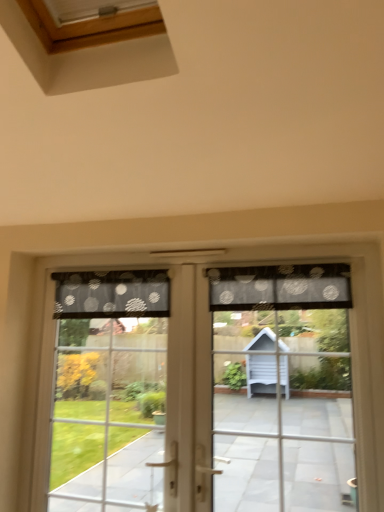
Question: From a real-world perspective, is translucent fabric curtain at left positioned under transparent fabric at center based on gravity?

Choices:
 (A) no
 (B) yes

Answer: (B)

Question: Is translucent fabric curtain at left not inside transparent fabric at center?

Choices:
 (A) yes
 (B) no

Answer: (B)

Question: Is translucent fabric curtain at left oriented away from transparent fabric at center?

Choices:
 (A) yes
 (B) no

Answer: (A)

Question: From a real-world perspective, is translucent fabric curtain at left over transparent fabric at center?

Choices:
 (A) yes
 (B) no

Answer: (B)

Question: Is translucent fabric curtain at left next to transparent fabric at center?

Choices:
 (A) yes
 (B) no

Answer: (B)

Question: Considering the relative positions of translucent fabric curtain at left and transparent fabric at center in the image provided, is translucent fabric curtain at left to the left of transparent fabric at center from the viewer's perspective?

Choices:
 (A) no
 (B) yes

Answer: (B)

Question: Are translucent polka dot curtain at center and black dotted fabric at upper center, which is the 2th curtain in left-to-right order, far apart?

Choices:
 (A) yes
 (B) no

Answer: (B)

Question: Considering the relative sizes of translucent polka dot curtain at center and black dotted fabric at upper center, which is the 2th curtain in left-to-right order, in the image provided, is translucent polka dot curtain at center bigger than black dotted fabric at upper center, which is the 2th curtain in left-to-right order,?

Choices:
 (A) yes
 (B) no

Answer: (A)

Question: Can you confirm if translucent polka dot curtain at center is smaller than black dotted fabric at upper center, the first curtain when ordered from right to left?

Choices:
 (A) yes
 (B) no

Answer: (B)

Question: Is translucent polka dot curtain at center at the right side of black dotted fabric at upper center, which is the 2th curtain in left-to-right order?

Choices:
 (A) yes
 (B) no

Answer: (B)

Question: Is translucent polka dot curtain at center positioned with its back to black dotted fabric at upper center, the first curtain when ordered from right to left?

Choices:
 (A) no
 (B) yes

Answer: (B)

Question: Is translucent polka dot curtain at center not inside black dotted fabric at upper center, the first curtain when ordered from right to left?

Choices:
 (A) no
 (B) yes

Answer: (B)

Question: From a real-world perspective, is translucent polka dot curtain at center over black dotted fabric at upper center, the second curtain when ordered from right to left?

Choices:
 (A) yes
 (B) no

Answer: (B)